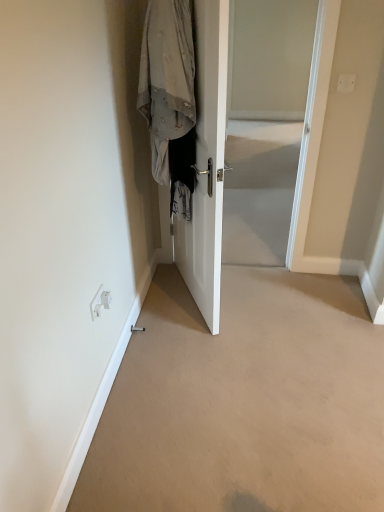
At what (x,y) coordinates should I click in order to perform the action: click on free spot above beige carpet at lower center (from a real-world perspective). Please return your answer as a coordinate pair (x, y). The width and height of the screenshot is (384, 512). Looking at the image, I should click on (273, 373).